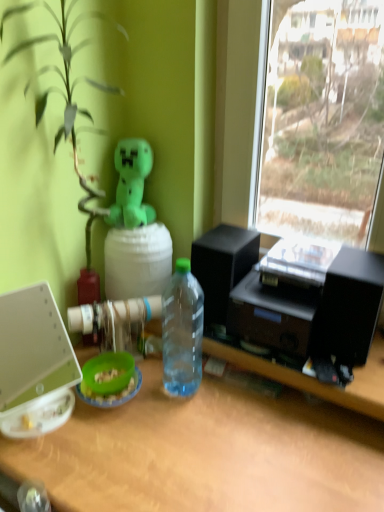
Question: Would you say white plastic laptop at left is outside green plush toy at upper center?

Choices:
 (A) no
 (B) yes

Answer: (B)

Question: Considering the relative positions of white plastic laptop at left and green plush toy at upper center in the image provided, is white plastic laptop at left behind green plush toy at upper center?

Choices:
 (A) yes
 (B) no

Answer: (B)

Question: From the image's perspective, is white plastic laptop at left beneath green plush toy at upper center?

Choices:
 (A) yes
 (B) no

Answer: (A)

Question: Is white plastic laptop at left facing away from green plush toy at upper center?

Choices:
 (A) yes
 (B) no

Answer: (B)

Question: Is green plush toy at upper center surrounded by white plastic laptop at left?

Choices:
 (A) no
 (B) yes

Answer: (A)

Question: From the image's perspective, is green plush toy at upper center located above or below white plastic laptop at left?

Choices:
 (A) above
 (B) below

Answer: (A)

Question: From a real-world perspective, is green plush toy at upper center above or below white plastic laptop at left?

Choices:
 (A) below
 (B) above

Answer: (B)

Question: Is green plush toy at upper center taller or shorter than white plastic laptop at left?

Choices:
 (A) tall
 (B) short

Answer: (B)

Question: Looking at the image, does green plush toy at upper center seem bigger or smaller compared to white plastic laptop at left?

Choices:
 (A) big
 (B) small

Answer: (B)

Question: Considering their positions, is transparent plastic bottle at center located in front of or behind green plush toy at upper center?

Choices:
 (A) behind
 (B) front

Answer: (B)

Question: Looking at their shapes, would you say transparent plastic bottle at center is wider or thinner than green plush toy at upper center?

Choices:
 (A) thin
 (B) wide

Answer: (A)

Question: Considering the positions of point (193, 324) and point (122, 177), is point (193, 324) closer or farther from the camera than point (122, 177)?

Choices:
 (A) farther
 (B) closer

Answer: (B)

Question: Do you think transparent plastic bottle at center is within green plush toy at upper center, or outside of it?

Choices:
 (A) inside
 (B) outside

Answer: (B)

Question: Based on their positions, is white plastic laptop at left located to the left or right of transparent plastic bottle at center?

Choices:
 (A) left
 (B) right

Answer: (A)

Question: From the image's perspective, is white plastic laptop at left above or below transparent plastic bottle at center?

Choices:
 (A) above
 (B) below

Answer: (B)